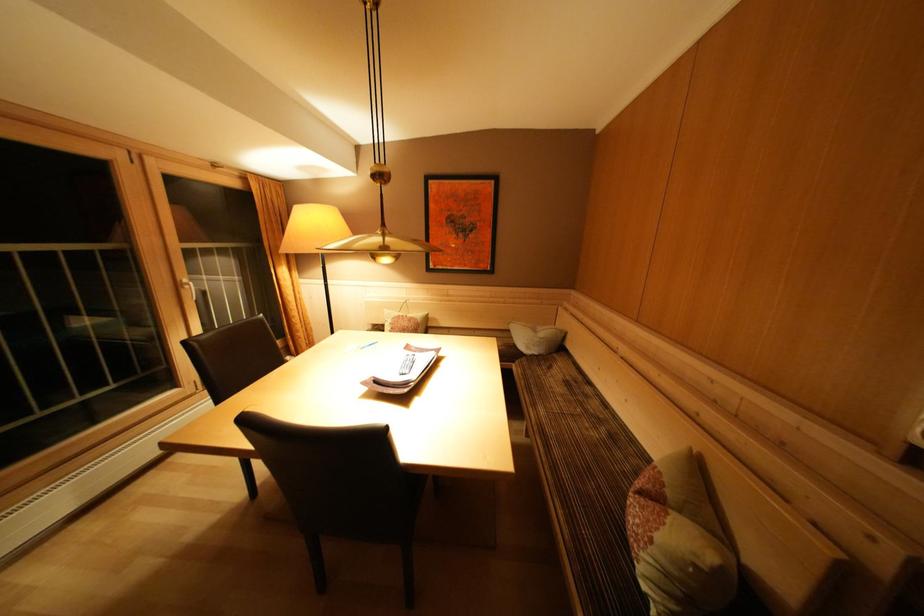
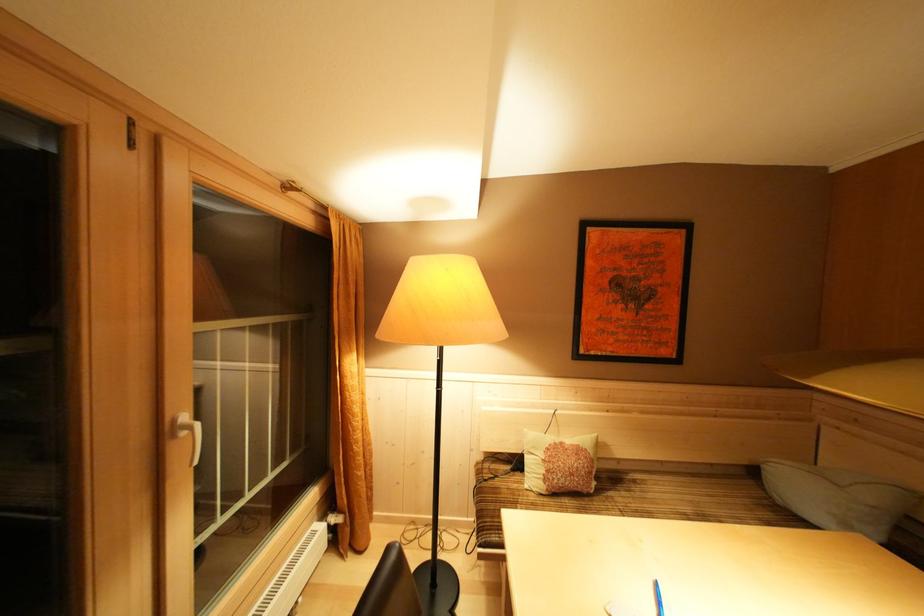
The point at (287, 270) is marked in the first image. Where is the corresponding point in the second image?

(358, 357)